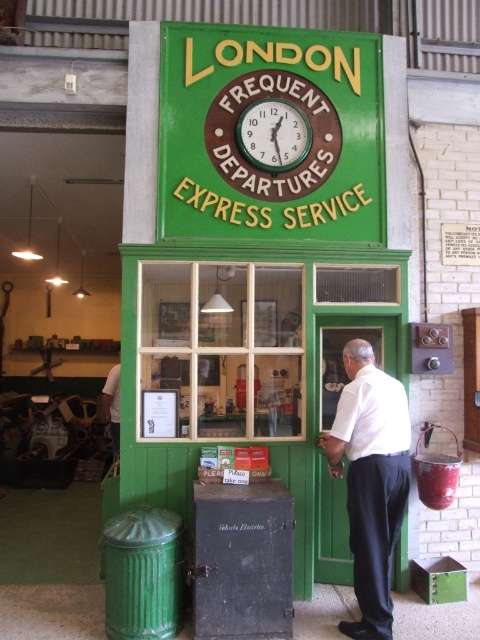
Does point (358, 627) lie in front of point (256, 116)?

Yes, it is in front of point (256, 116).

Does white shirt at center appear over green painted wood clock at upper center?

No.

You are a GUI agent. You are given a task and a screenshot of the screen. Output one action in this format:
    pyautogui.click(x=<x>, y=<y>)
    Task: Click on the white shirt at center
    The width and height of the screenshot is (480, 640).
    Given the screenshot: What is the action you would take?
    pyautogui.click(x=371, y=481)

Does green wooden window at center appear over green painted wood clock at upper center?

No, green wooden window at center is not above green painted wood clock at upper center.

Can you confirm if green wooden window at center is smaller than green painted wood clock at upper center?

Actually, green wooden window at center might be larger than green painted wood clock at upper center.

Image resolution: width=480 pixels, height=640 pixels. I want to click on green wooden window at center, so click(x=220, y=349).

Identify the location of green wooden window at center. The image size is (480, 640). (x=220, y=349).

In the scene shown: Is green wooden window at center closer to the viewer compared to white shirt at center?

No, it is behind white shirt at center.

Does point (247, 413) come behind point (355, 365)?

Yes, point (247, 413) is behind point (355, 365).

You are a GUI agent. You are given a task and a screenshot of the screen. Output one action in this format:
    pyautogui.click(x=<x>, y=<y>)
    Task: Click on the green wooden window at center
    The width and height of the screenshot is (480, 640).
    Given the screenshot: What is the action you would take?
    (x=220, y=349)

The width and height of the screenshot is (480, 640). Identify the location of green wooden window at center. (220, 349).